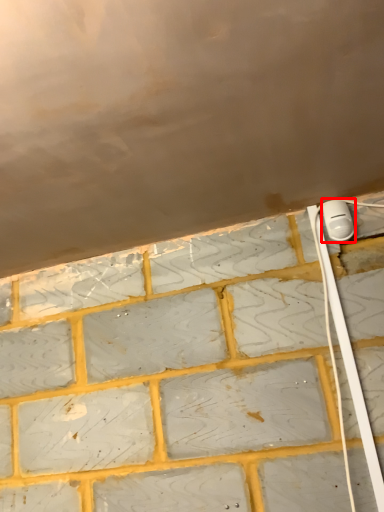
Question: Considering the relative positions of power plugs and sockets (annotated by the red box) and cable in the image provided, where is power plugs and sockets (annotated by the red box) located with respect to the staircase?

Choices:
 (A) left
 (B) right

Answer: (B)